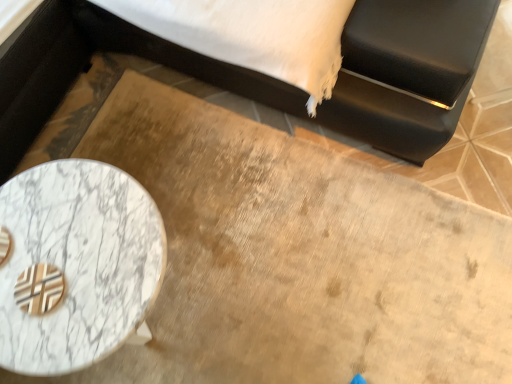
Measure the distance between point (127, 329) and camera.

They are 32.91 inches apart.

Image resolution: width=512 pixels, height=384 pixels. What do you see at coordinates (78, 263) in the screenshot?
I see `marble table at lower left` at bounding box center [78, 263].

I want to click on marble table at lower left, so click(78, 263).

Describe the element at coordinates (407, 72) in the screenshot. I see `black leather bed at upper left` at that location.

Find the location of a particular element. The width and height of the screenshot is (512, 384). black leather bed at upper left is located at coordinates (407, 72).

At what (x,y) coordinates should I click in order to perform the action: click on marble table at lower left. Please return your answer as a coordinate pair (x, y). Looking at the image, I should click on (78, 263).

From the picture: Considering the positions of objects marble table at lower left and black leather bed at upper left in the image provided, who is more to the left, marble table at lower left or black leather bed at upper left?

From the viewer's perspective, marble table at lower left appears more on the left side.

Consider the image. Is the position of marble table at lower left less distant than that of black leather bed at upper left?

No, marble table at lower left is further to the viewer.

From the picture: Which is more distant, (2, 346) or (470, 12)?

Point (470, 12)

From the image's perspective, who appears lower, marble table at lower left or black leather bed at upper left?

marble table at lower left is shown below in the image.

From a real-world perspective, which object rests below the other?

marble table at lower left.

Is marble table at lower left wider or thinner than black leather bed at upper left?

marble table at lower left is thinner than black leather bed at upper left.

Between marble table at lower left and black leather bed at upper left, which one has less height?

marble table at lower left.

Based on the photo, between marble table at lower left and black leather bed at upper left, which one has larger size?

black leather bed at upper left is bigger.

Which is correct: marble table at lower left is inside black leather bed at upper left, or outside of it?

The correct answer is: outside.

Are marble table at lower left and black leather bed at upper left making contact?

They are not placed beside each other.

Could you tell me if marble table at lower left is facing black leather bed at upper left?

No, marble table at lower left is not aimed at black leather bed at upper left.

Find the location of a particular element. bed above the marble table at lower left (from a real-world perspective) is located at coordinates (407, 72).

Is black leather bed at upper left at the right side of marble table at lower left?

Yes, black leather bed at upper left is to the right of marble table at lower left.

Is black leather bed at upper left closer to the viewer compared to marble table at lower left?

Yes, black leather bed at upper left is closer to the camera.

Which is behind, point (208, 76) or point (8, 288)?

Point (208, 76)

From the image's perspective, would you say black leather bed at upper left is shown under marble table at lower left?

Actually, black leather bed at upper left appears above marble table at lower left in the image.

From a real-world perspective, is black leather bed at upper left physically above marble table at lower left?

Yes, from a real-world perspective, black leather bed at upper left is over marble table at lower left

Is black leather bed at upper left wider or thinner than marble table at lower left?

Considering their sizes, black leather bed at upper left looks broader than marble table at lower left.

Considering the sizes of objects black leather bed at upper left and marble table at lower left in the image provided, who is taller, black leather bed at upper left or marble table at lower left?

black leather bed at upper left is taller.

Between black leather bed at upper left and marble table at lower left, which one has larger size?

black leather bed at upper left.

Is black leather bed at upper left outside of marble table at lower left?

Indeed, black leather bed at upper left is completely outside marble table at lower left.

Is black leather bed at upper left not near marble table at lower left?

black leather bed at upper left is actually quite close to marble table at lower left.

From the picture: Is black leather bed at upper left oriented towards marble table at lower left?

Yes, black leather bed at upper left faces towards marble table at lower left.

How much distance is there between black leather bed at upper left and marble table at lower left?

23.38 inches.

Where is `table below the black leather bed at upper left (from the image's perspective)`? The image size is (512, 384). table below the black leather bed at upper left (from the image's perspective) is located at coordinates point(78,263).

In order to click on table behind the black leather bed at upper left in this screenshot , I will do `click(78, 263)`.

Where is `table below the black leather bed at upper left (from a real-world perspective)`? The width and height of the screenshot is (512, 384). table below the black leather bed at upper left (from a real-world perspective) is located at coordinates pyautogui.click(x=78, y=263).